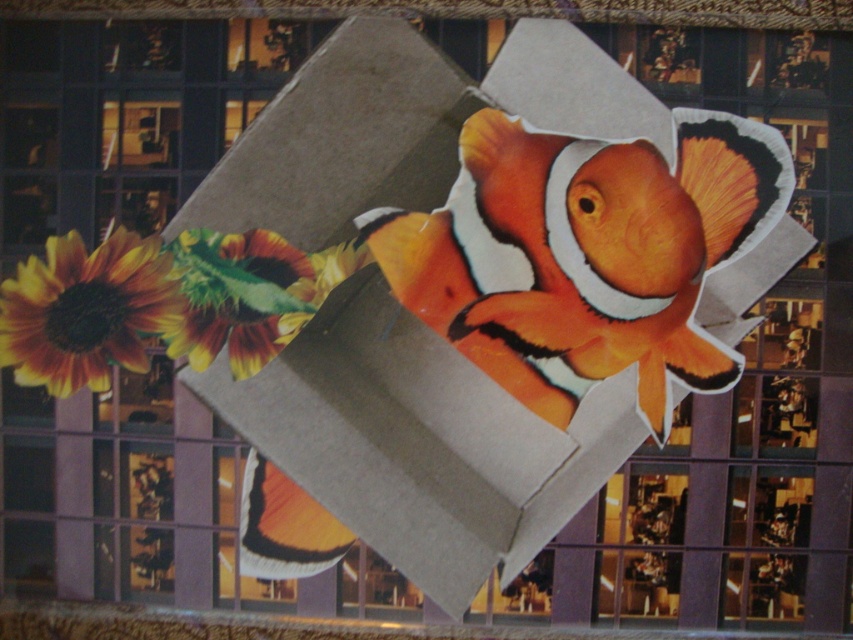
Can you confirm if orange matte clownfish at center is positioned above yellow-green textured leaf at lower left?

Yes.

Which is behind, point (531, 232) or point (251, 371)?

The point (251, 371) is more distant.

Find the location of a particular element. This screenshot has width=853, height=640. orange matte clownfish at center is located at coordinates (585, 253).

Who is lower down, matte gray cardboard box at center or yellow-green textured leaf at lower left?

Positioned lower is matte gray cardboard box at center.

Who is more forward, (490,468) or (262,232)?

Positioned in front is point (262,232).

Which is in front, point (219, 172) or point (231, 308)?

Positioned in front is point (219, 172).

The width and height of the screenshot is (853, 640). In order to click on matte gray cardboard box at center in this screenshot , I will do `click(421, 444)`.

Does matte gray cardboard box at center have a lesser height compared to orange matte clownfish at center?

No.

Who is more forward, [431,51] or [514,180]?

Point [514,180]

Locate an element on the screen. The image size is (853, 640). matte gray cardboard box at center is located at coordinates (421, 444).